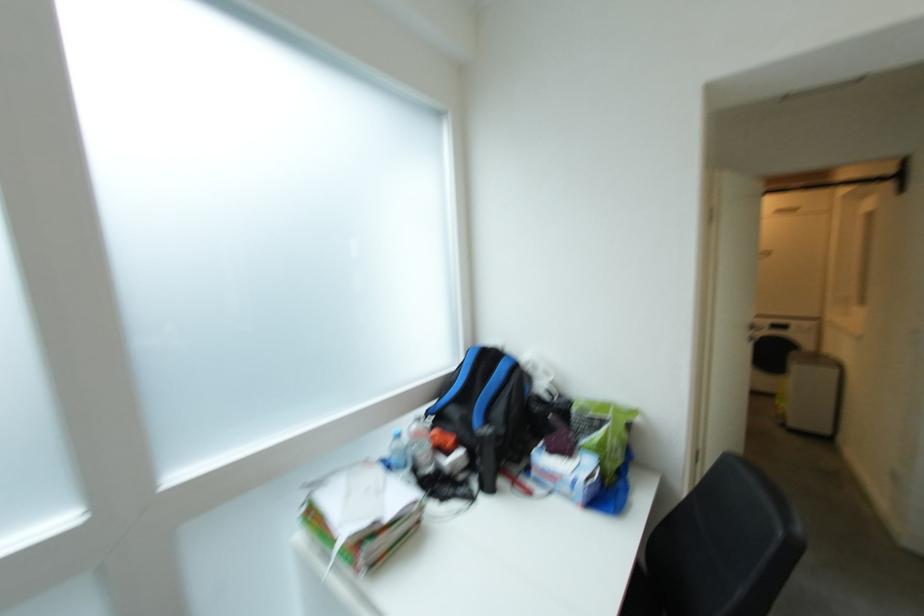
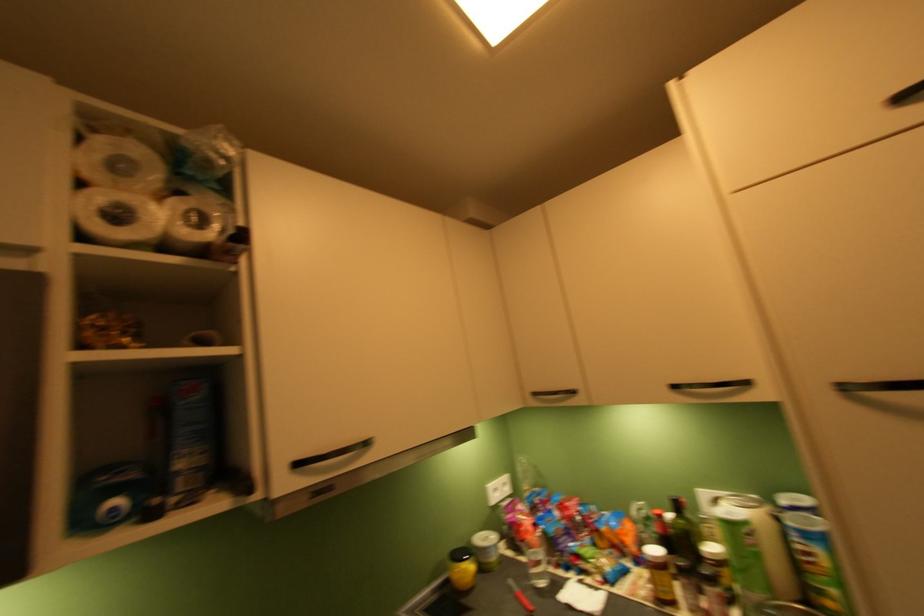
Which direction would the cameraman need to move to produce the second image?

The movement direction of the cameraman is right, forward.